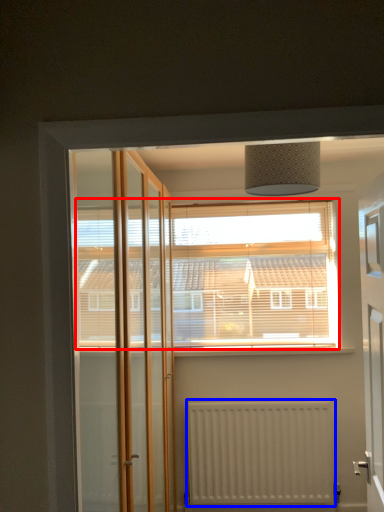
Question: Among these objects, which one is farthest to the camera, window (highlighted by a red box) or radiator (highlighted by a blue box)?

Choices:
 (A) window
 (B) radiator

Answer: (A)